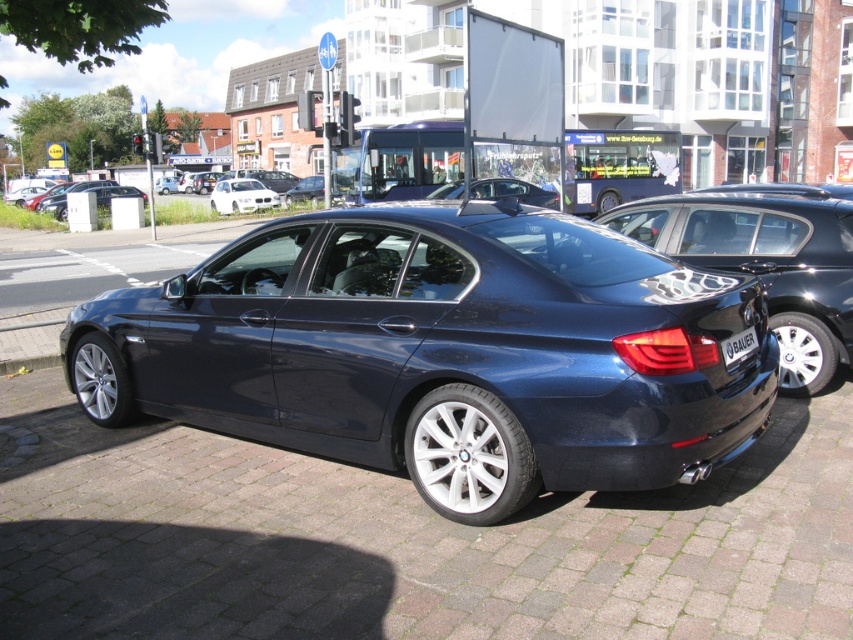
Is satin dark blue sedan at center positioned behind white glossy sedan at upper center?

No, it is in front of white glossy sedan at upper center.

From the picture: Does satin dark blue sedan at center have a lesser height compared to white glossy sedan at upper center?

Yes.

At what (x,y) coordinates should I click in order to perform the action: click on satin dark blue sedan at center. Please return your answer as a coordinate pair (x, y). The width and height of the screenshot is (853, 640). Looking at the image, I should click on (442, 353).

Identify the location of satin dark blue sedan at center. (442, 353).

Between satin dark blue sedan at center and glossy dark blue sedan at center, which one has more height?

With more height is glossy dark blue sedan at center.

You are a GUI agent. You are given a task and a screenshot of the screen. Output one action in this format:
    pyautogui.click(x=<x>, y=<y>)
    Task: Click on the satin dark blue sedan at center
    
    Given the screenshot: What is the action you would take?
    pyautogui.click(x=442, y=353)

Which is behind, point (265, 192) or point (735, 352)?

The point (265, 192) is behind.

Does point (212, 202) come in front of point (734, 337)?

No, it is behind (734, 337).

At what (x,y) coordinates should I click in order to perform the action: click on white glossy sedan at upper center. Please return your answer as a coordinate pair (x, y). This screenshot has height=640, width=853. Looking at the image, I should click on (241, 195).